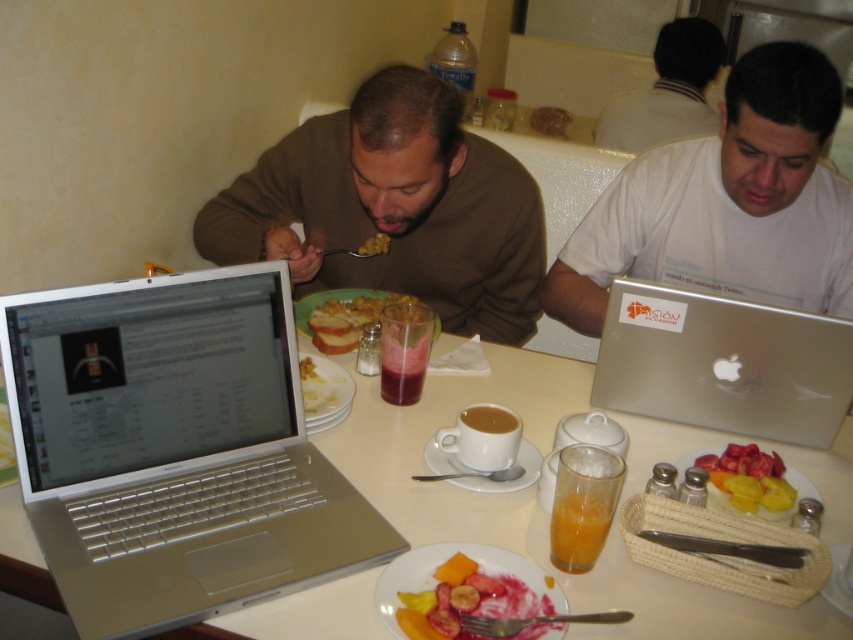
Which is above, yellow smooth pineapple at right or translucent glass juice at center?

translucent glass juice at center

Between yellow smooth pineapple at right and translucent glass juice at center, which one is positioned lower?

yellow smooth pineapple at right

Who is more forward, (749, 465) or (413, 337)?

Point (749, 465)

Where is `yellow smooth pineapple at right`? Image resolution: width=853 pixels, height=640 pixels. yellow smooth pineapple at right is located at coordinates (749, 480).

Does point (85, 420) come in front of point (656, 349)?

Yes.

Is point (224, 339) positioned behind point (705, 342)?

No.

Where is `silver metallic laptop at center`? silver metallic laptop at center is located at coordinates (173, 451).

How far apart are silver metallic laptop at center and yellow matte corn at center?

They are 28.16 inches apart.

This screenshot has width=853, height=640. Identify the location of silver metallic laptop at center. (173, 451).